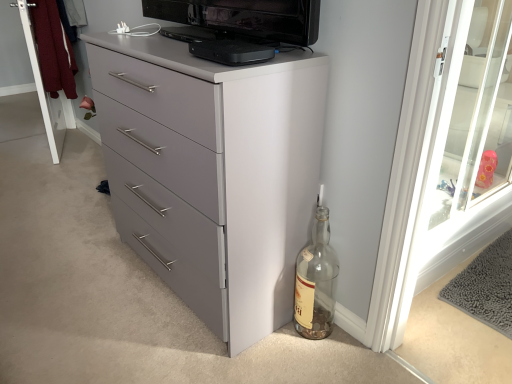
Question: Is black plastic device at upper center completely or partially outside of transparent glass screen door at upper right, which is the 2th screen door in left-to-right order?

Choices:
 (A) yes
 (B) no

Answer: (A)

Question: Is black plastic device at upper center touching transparent glass screen door at upper right, which is the 2th screen door in left-to-right order?

Choices:
 (A) yes
 (B) no

Answer: (B)

Question: Can you confirm if black plastic device at upper center is wider than transparent glass screen door at upper right, which is counted as the 1th screen door, starting from the front?

Choices:
 (A) yes
 (B) no

Answer: (A)

Question: Can you confirm if black plastic device at upper center is smaller than transparent glass screen door at upper right, which is the 2th screen door in left-to-right order?

Choices:
 (A) no
 (B) yes

Answer: (B)

Question: Can you confirm if black plastic device at upper center is thinner than transparent glass screen door at upper right, which is counted as the 1th screen door, starting from the front?

Choices:
 (A) no
 (B) yes

Answer: (A)

Question: From the image's perspective, relative to white wood screen door at upper left, placed as the first screen door when sorted from left to right, is black plastic device at upper center above or below?

Choices:
 (A) below
 (B) above

Answer: (A)

Question: From a real-world perspective, is black plastic device at upper center above or below white wood screen door at upper left, placed as the first screen door when sorted from left to right?

Choices:
 (A) above
 (B) below

Answer: (A)

Question: Is black plastic device at upper center inside or outside of white wood screen door at upper left, which is counted as the second screen door, starting from the right?

Choices:
 (A) inside
 (B) outside

Answer: (B)

Question: Considering their positions, is black plastic device at upper center located in front of or behind white wood screen door at upper left, which is counted as the second screen door, starting from the right?

Choices:
 (A) front
 (B) behind

Answer: (A)

Question: In terms of size, does transparent glass screen door at upper right, which is the 1th screen door in right-to-left order, appear bigger or smaller than clear glass bottle at lower right?

Choices:
 (A) small
 (B) big

Answer: (B)

Question: Does point (471, 119) appear closer or farther from the camera than point (309, 301)?

Choices:
 (A) closer
 (B) farther

Answer: (B)

Question: From a real-world perspective, is transparent glass screen door at upper right, which is the 1th screen door in right-to-left order, positioned above or below clear glass bottle at lower right?

Choices:
 (A) below
 (B) above

Answer: (B)

Question: Would you say transparent glass screen door at upper right, which is the 1th screen door in right-to-left order, is to the left or to the right of clear glass bottle at lower right in the picture?

Choices:
 (A) left
 (B) right

Answer: (B)

Question: Considering the relative positions of matte gray chest of drawers at center and clear glass bottle at lower right in the image provided, is matte gray chest of drawers at center to the left or to the right of clear glass bottle at lower right?

Choices:
 (A) right
 (B) left

Answer: (B)

Question: Is matte gray chest of drawers at center in front of or behind clear glass bottle at lower right in the image?

Choices:
 (A) front
 (B) behind

Answer: (A)